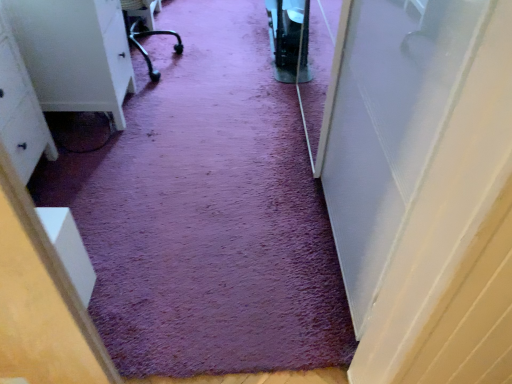
Describe the element at coordinates (207, 212) in the screenshot. I see `purple carpet at center` at that location.

Find the location of `purple carpet at center`. purple carpet at center is located at coordinates pyautogui.click(x=207, y=212).

The height and width of the screenshot is (384, 512). What do you see at coordinates (20, 109) in the screenshot? I see `white matte dresser at left` at bounding box center [20, 109].

Image resolution: width=512 pixels, height=384 pixels. What are the coordinates of `white matte dresser at left` in the screenshot? It's located at (20, 109).

Identify the location of purple carpet at center. The width and height of the screenshot is (512, 384). (207, 212).

Which object is positioned more to the left, purple carpet at center or white matte dresser at left?

From the viewer's perspective, white matte dresser at left appears more on the left side.

Is purple carpet at center positioned before white matte dresser at left?

No, purple carpet at center is further to the viewer.

Does point (139, 268) appear closer or farther from the camera than point (42, 131)?

Clearly, point (139, 268) is closer to the camera than point (42, 131).

From the image's perspective, is purple carpet at center on top of white matte dresser at left?

Yes, from the image's perspective, purple carpet at center is above white matte dresser at left.

From a real-world perspective, relative to white matte dresser at left, is purple carpet at center vertically above or below?

Clearly, from a real-world perspective, purple carpet at center is below white matte dresser at left.

In terms of width, does purple carpet at center look wider or thinner when compared to white matte dresser at left?

Considering their sizes, purple carpet at center looks broader than white matte dresser at left.

Considering the sizes of objects purple carpet at center and white matte dresser at left in the image provided, who is shorter, purple carpet at center or white matte dresser at left?

purple carpet at center is shorter.

Can you confirm if purple carpet at center is bigger than white matte dresser at left?

Correct, purple carpet at center is larger in size than white matte dresser at left.

Choose the correct answer: Is purple carpet at center inside white matte dresser at left or outside it?

purple carpet at center is not enclosed by white matte dresser at left.

Is purple carpet at center not near white matte dresser at left?

That's not correct — purple carpet at center is a little close to white matte dresser at left.

Is purple carpet at center aimed at white matte dresser at left?

No, purple carpet at center is not turned towards white matte dresser at left.

The image size is (512, 384). I want to click on furniture above the purple carpet at center (from a real-world perspective), so click(x=20, y=109).

Visually, is white matte dresser at left positioned to the left or to the right of purple carpet at center?

white matte dresser at left is to the left of purple carpet at center.

Considering their positions, is white matte dresser at left located in front of or behind purple carpet at center?

Clearly, white matte dresser at left is in front of purple carpet at center.

Is point (40, 117) less distant than point (191, 347)?

No, it is behind (191, 347).

From the image's perspective, is white matte dresser at left over purple carpet at center?

No.

Looking at this image, from a real-world perspective, who is located lower, white matte dresser at left or purple carpet at center?

purple carpet at center is physically lower.

Is white matte dresser at left thinner than purple carpet at center?

Yes, white matte dresser at left is thinner than purple carpet at center.

Considering the sizes of white matte dresser at left and purple carpet at center in the image, is white matte dresser at left taller or shorter than purple carpet at center?

In the image, white matte dresser at left appears to be taller than purple carpet at center.

Based on their sizes in the image, would you say white matte dresser at left is bigger or smaller than purple carpet at center?

Clearly, white matte dresser at left is smaller in size than purple carpet at center.

Is white matte dresser at left spatially inside purple carpet at center, or outside of it?

white matte dresser at left is not inside purple carpet at center, it's outside.

Is white matte dresser at left far away from purple carpet at center?

Actually, white matte dresser at left and purple carpet at center are a little close together.

Could you tell me if white matte dresser at left is turned towards purple carpet at center?

No, white matte dresser at left does not turn towards purple carpet at center.

What's the angular difference between white matte dresser at left and purple carpet at center's facing directions?

87.8 degrees.

In order to click on furniture positioned vertically above the purple carpet at center (from a real-world perspective) in this screenshot , I will do `click(20, 109)`.

The height and width of the screenshot is (384, 512). Identify the location of doormat on the right of white matte dresser at left. (207, 212).

Locate an element on the screen. This screenshot has height=384, width=512. furniture that is in front of the purple carpet at center is located at coordinates (20, 109).